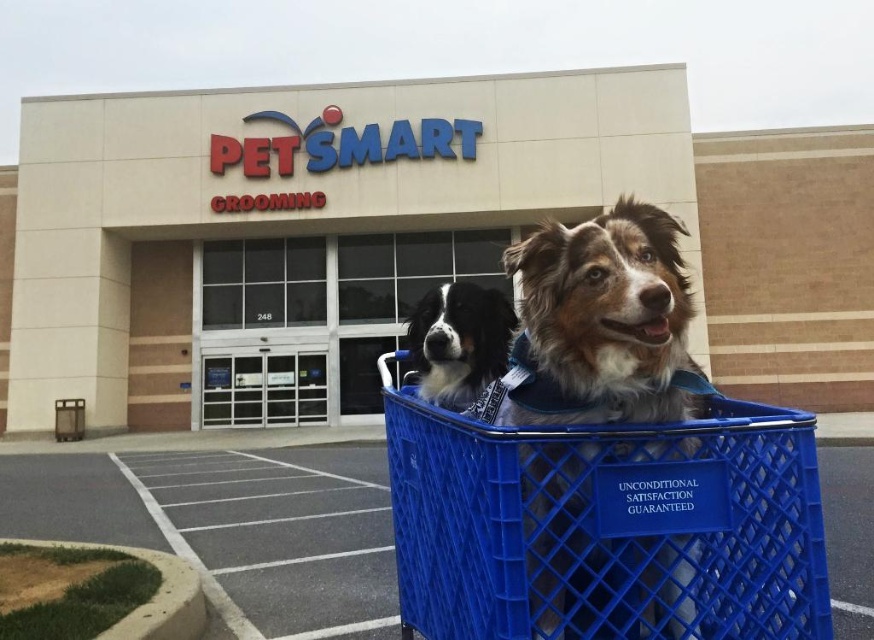
Which of these two, beige concrete building at center or blue plastic basket at center, stands shorter?

blue plastic basket at center is shorter.

Is beige concrete building at center positioned at the back of blue plastic basket at center?

That is True.

Between point (314, 296) and point (727, 604), which one is positioned in front?

Point (727, 604)

What are the coordinates of `beige concrete building at center` in the screenshot? It's located at (282, 221).

Looking at this image, between beige concrete building at center and black and white fur at center, which one is positioned lower?

black and white fur at center

From the picture: Is beige concrete building at center closer to the viewer compared to black and white fur at center?

No, beige concrete building at center is behind black and white fur at center.

You are a GUI agent. You are given a task and a screenshot of the screen. Output one action in this format:
    pyautogui.click(x=<x>, y=<y>)
    Task: Click on the beige concrete building at center
    The width and height of the screenshot is (874, 640).
    Given the screenshot: What is the action you would take?
    pyautogui.click(x=282, y=221)

This screenshot has width=874, height=640. Identify the location of beige concrete building at center. (282, 221).

Is blue plastic basket at center behind black and white fur at center?

No, blue plastic basket at center is closer to the viewer.

Measure the distance from blue plastic basket at center to black and white fur at center.

59.18 centimeters

Find the location of a particular element. The height and width of the screenshot is (640, 874). blue plastic basket at center is located at coordinates (605, 524).

Where is `blue plastic basket at center`? The image size is (874, 640). blue plastic basket at center is located at coordinates (605, 524).